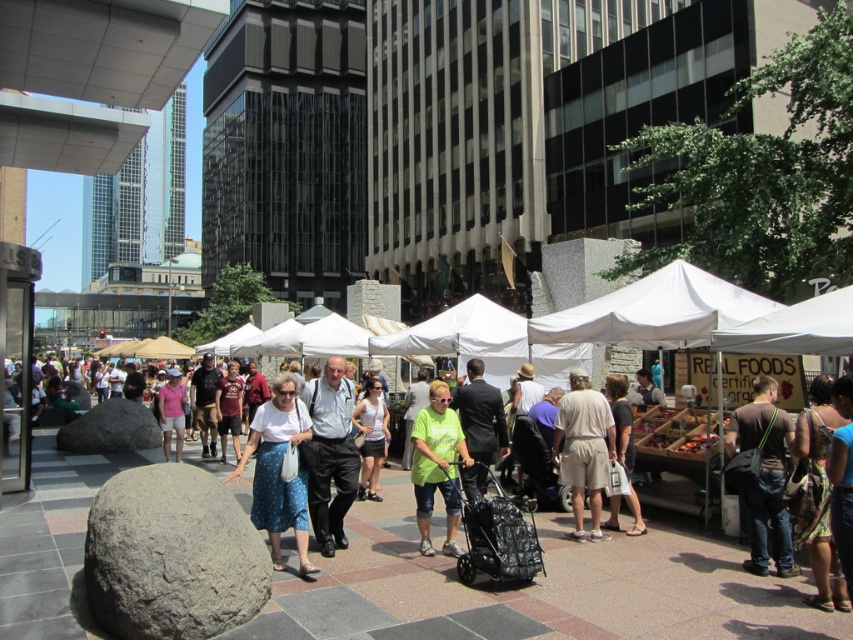
You are a photographer standing in the market and want to capture both the dark brown leather backpack at lower right and the white cotton tank top at center in a single photo. Which object should you position closer to the camera to ensure both fit in the frame?

Since the dark brown leather backpack at lower right is wider than the white cotton tank top at center, you should position the dark brown leather backpack at lower right closer to the camera to accommodate its larger width in the frame.